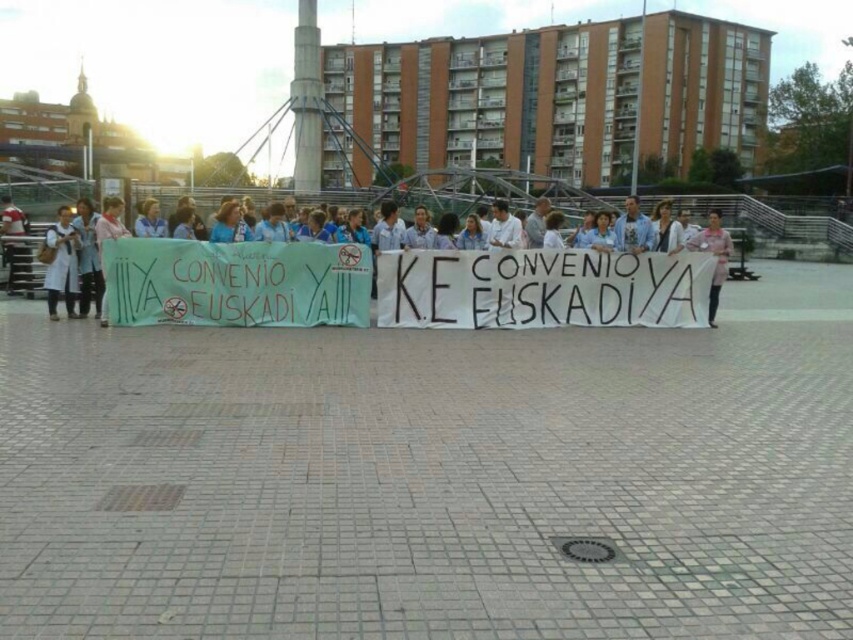
Question: Does light blue shirt at center have a lesser width compared to pink fabric at center?

Choices:
 (A) yes
 (B) no

Answer: (A)

Question: Which of the following is the farthest from the observer?

Choices:
 (A) pos(67,225)
 (B) pos(701,232)

Answer: (B)

Question: Which object appears closest to the camera in this image?

Choices:
 (A) light blue shirt at left
 (B) light blue shirt at center

Answer: (B)

Question: Is light blue shirt at left to the left of pink fabric at center from the viewer's perspective?

Choices:
 (A) yes
 (B) no

Answer: (A)

Question: Is light blue shirt at center wider than pink fabric at center?

Choices:
 (A) no
 (B) yes

Answer: (A)

Question: Estimate the real-world distances between objects in this image. Which object is closer to the pink fabric at center?

Choices:
 (A) light blue shirt at left
 (B) light blue shirt at center

Answer: (B)